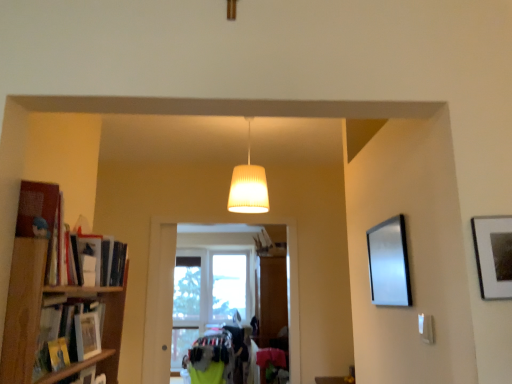
Question: Can you confirm if hardcover book at left, positioned as the first book in back-to-front order, is smaller than silver metallic picture frame at right?

Choices:
 (A) yes
 (B) no

Answer: (B)

Question: Is hardcover book at left, positioned as the second book in top-to-bottom order, to the left of silver metallic picture frame at right from the viewer's perspective?

Choices:
 (A) no
 (B) yes

Answer: (B)

Question: Is hardcover book at left, which is the 2th book in bottom-to-top order, not within silver metallic picture frame at right?

Choices:
 (A) no
 (B) yes

Answer: (B)

Question: Can you confirm if hardcover book at left, positioned as the first book in back-to-front order, is taller than silver metallic picture frame at right?

Choices:
 (A) no
 (B) yes

Answer: (A)

Question: Considering the relative sizes of hardcover book at left, positioned as the second book in top-to-bottom order, and silver metallic picture frame at right in the image provided, is hardcover book at left, positioned as the second book in top-to-bottom order, bigger than silver metallic picture frame at right?

Choices:
 (A) no
 (B) yes

Answer: (B)

Question: In terms of width, does matte black bookshelf at left, marked as the 3th book in a back-to-front arrangement, look wider or thinner when compared to silver metallic picture frame at right?

Choices:
 (A) wide
 (B) thin

Answer: (A)

Question: Relative to silver metallic picture frame at right, is matte black bookshelf at left, positioned as the first book in top-to-bottom order, in front or behind?

Choices:
 (A) behind
 (B) front

Answer: (B)

Question: Considering the positions of matte black bookshelf at left, marked as the 3th book in a back-to-front arrangement, and silver metallic picture frame at right in the image, is matte black bookshelf at left, marked as the 3th book in a back-to-front arrangement, bigger or smaller than silver metallic picture frame at right?

Choices:
 (A) small
 (B) big

Answer: (B)

Question: From their relative heights in the image, would you say matte black bookshelf at left, marked as the 3th book in a back-to-front arrangement, is taller or shorter than silver metallic picture frame at right?

Choices:
 (A) short
 (B) tall

Answer: (A)

Question: Looking at their shapes, would you say wooden photo frame at left, arranged as the second book when viewed from the back, is wider or thinner than matte black bookshelf at left, marked as the 3th book in a back-to-front arrangement?

Choices:
 (A) thin
 (B) wide

Answer: (A)

Question: Considering the positions of wooden photo frame at left, arranged as the second book when viewed from the back, and matte black bookshelf at left, marked as the 3th book in a back-to-front arrangement, in the image, is wooden photo frame at left, arranged as the second book when viewed from the back, taller or shorter than matte black bookshelf at left, marked as the 3th book in a back-to-front arrangement,?

Choices:
 (A) tall
 (B) short

Answer: (B)

Question: From the image's perspective, is wooden photo frame at left, arranged as the second book when viewed from the back, positioned above or below matte black bookshelf at left, positioned as the first book in top-to-bottom order?

Choices:
 (A) below
 (B) above

Answer: (A)

Question: Is wooden photo frame at left, arranged as the second book when viewed from the back, bigger or smaller than matte black bookshelf at left, marked as the 3th book in a back-to-front arrangement?

Choices:
 (A) small
 (B) big

Answer: (A)

Question: Visually, is wooden bookshelf at left positioned to the left or to the right of white ribbed lampshade at center?

Choices:
 (A) right
 (B) left

Answer: (B)

Question: From the image's perspective, is wooden bookshelf at left above or below white ribbed lampshade at center?

Choices:
 (A) below
 (B) above

Answer: (A)